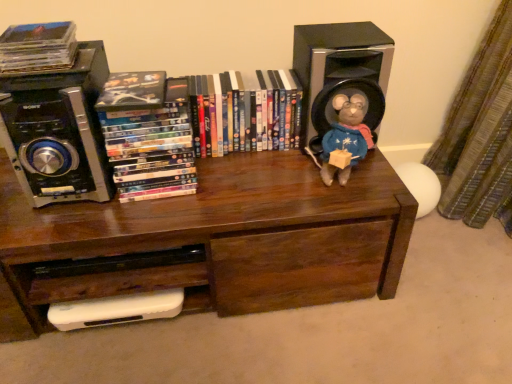
Locate an element on the screen. This screenshot has width=512, height=384. vacant area to the right of matte plastic dvds at left, positioned as the 2th book in right-to-left order is located at coordinates (236, 180).